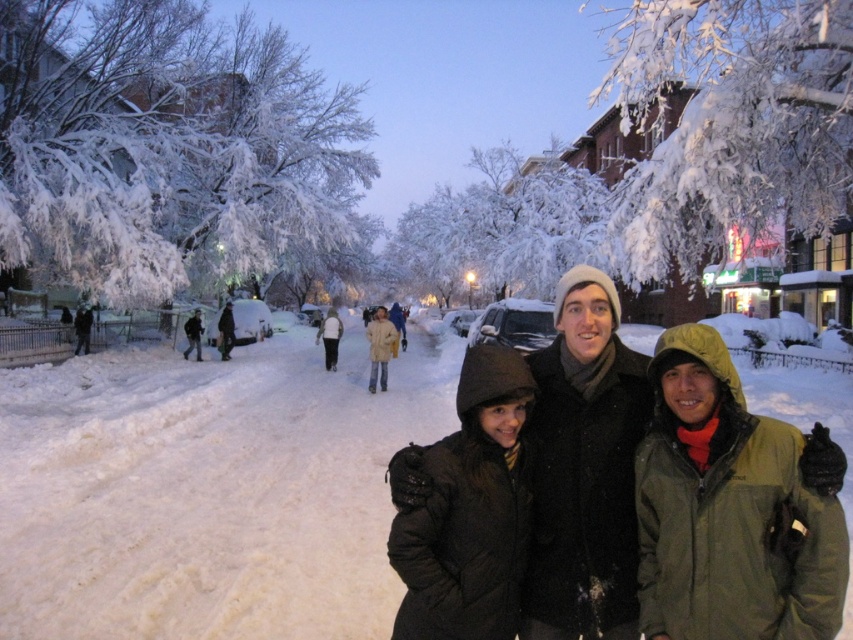
Question: Which point appears farthest from the camera in this image?

Choices:
 (A) (527, 436)
 (B) (184, 328)
 (C) (378, 342)
 (D) (598, 413)

Answer: (B)

Question: Which point is closer to the camera?

Choices:
 (A) dark gray wool coat at center
 (B) black quilted jacket at center
 (C) dark gray jacket at lower left
 (D) light brown fur coat at center

Answer: (B)

Question: Which point is closer to the camera taking this photo?

Choices:
 (A) (839, 483)
 (B) (328, 317)
 (C) (199, 355)

Answer: (A)

Question: Is dark brown jacket at center smaller than white matte jacket at center?

Choices:
 (A) no
 (B) yes

Answer: (B)

Question: Is light brown fur coat at center bigger than dark gray wool coat at center?

Choices:
 (A) yes
 (B) no

Answer: (A)

Question: Does light brown fur coat at center appear on the right side of dark gray jacket at lower left?

Choices:
 (A) yes
 (B) no

Answer: (A)